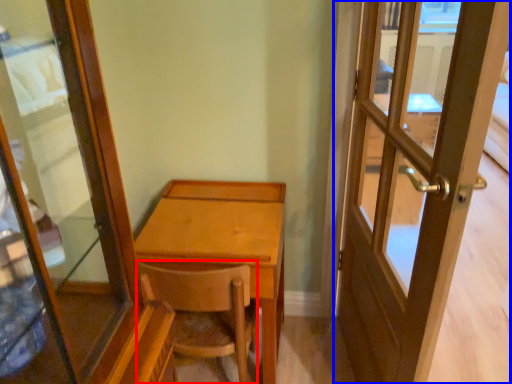
Question: Which point is further to the camera, chair (highlighted by a red box) or door (highlighted by a blue box)?

Choices:
 (A) chair
 (B) door

Answer: (A)